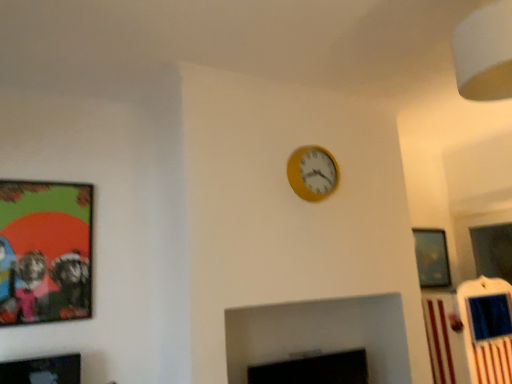
Question: Is black matte fireplace at lower center beside yellow matte wall clock at upper center?

Choices:
 (A) no
 (B) yes

Answer: (A)

Question: Does black matte fireplace at lower center have a lesser width compared to yellow matte wall clock at upper center?

Choices:
 (A) no
 (B) yes

Answer: (B)

Question: Is black matte fireplace at lower center facing towards yellow matte wall clock at upper center?

Choices:
 (A) no
 (B) yes

Answer: (A)

Question: Considering the relative positions of black matte fireplace at lower center and yellow matte wall clock at upper center in the image provided, is black matte fireplace at lower center in front of yellow matte wall clock at upper center?

Choices:
 (A) yes
 (B) no

Answer: (A)

Question: Does black matte fireplace at lower center have a lesser height compared to yellow matte wall clock at upper center?

Choices:
 (A) yes
 (B) no

Answer: (A)

Question: Would you say matte plastic picture frame at left, the second picture frame when ordered from front to back, is to the left or to the right of matte black picture frame at lower left, arranged as the first picture frame when viewed from the front, in the picture?

Choices:
 (A) right
 (B) left

Answer: (B)

Question: Considering the positions of matte plastic picture frame at left, the second picture frame in the back-to-front sequence, and matte black picture frame at lower left, the 2th picture frame when ordered from left to right, in the image, is matte plastic picture frame at left, the second picture frame in the back-to-front sequence, taller or shorter than matte black picture frame at lower left, the 2th picture frame when ordered from left to right,?

Choices:
 (A) short
 (B) tall

Answer: (B)

Question: Is point (62, 284) closer or farther from the camera than point (73, 377)?

Choices:
 (A) farther
 (B) closer

Answer: (A)

Question: In terms of size, does matte plastic picture frame at left, the second picture frame when ordered from front to back, appear bigger or smaller than matte black picture frame at lower left, arranged as the first picture frame when viewed from the front?

Choices:
 (A) big
 (B) small

Answer: (A)

Question: Relative to metallic silver picture frame at upper right, which appears as the third picture frame when viewed from the front, is black matte fireplace at lower center in front or behind?

Choices:
 (A) front
 (B) behind

Answer: (A)

Question: Considering the relative positions of black matte fireplace at lower center and metallic silver picture frame at upper right, which is the first picture frame from right to left, in the image provided, is black matte fireplace at lower center to the left or to the right of metallic silver picture frame at upper right, which is the first picture frame from right to left,?

Choices:
 (A) left
 (B) right

Answer: (A)

Question: From the image's perspective, is black matte fireplace at lower center above or below metallic silver picture frame at upper right, which appears as the third picture frame when viewed from the front?

Choices:
 (A) above
 (B) below

Answer: (B)

Question: From a real-world perspective, is black matte fireplace at lower center positioned above or below metallic silver picture frame at upper right, the 1th picture frame viewed from the back?

Choices:
 (A) above
 (B) below

Answer: (B)

Question: In terms of width, does yellow matte wall clock at upper center look wider or thinner when compared to matte black picture frame at lower left, the 2th picture frame when ordered from left to right?

Choices:
 (A) thin
 (B) wide

Answer: (A)

Question: Considering the positions of yellow matte wall clock at upper center and matte black picture frame at lower left, the 2th picture frame viewed from the right, in the image, is yellow matte wall clock at upper center bigger or smaller than matte black picture frame at lower left, the 2th picture frame viewed from the right,?

Choices:
 (A) big
 (B) small

Answer: (A)